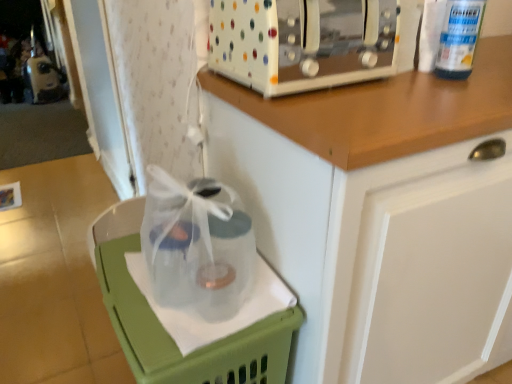
Question: Is white polka dot toaster at upper center oriented away from green plastic basket at lower left?

Choices:
 (A) no
 (B) yes

Answer: (A)

Question: Considering the relative sizes of white polka dot toaster at upper center and green plastic basket at lower left in the image provided, is white polka dot toaster at upper center smaller than green plastic basket at lower left?

Choices:
 (A) no
 (B) yes

Answer: (B)

Question: Is white polka dot toaster at upper center wider than green plastic basket at lower left?

Choices:
 (A) no
 (B) yes

Answer: (A)

Question: From a real-world perspective, is white polka dot toaster at upper center physically below green plastic basket at lower left?

Choices:
 (A) yes
 (B) no

Answer: (B)

Question: Considering the relative sizes of white polka dot toaster at upper center and green plastic basket at lower left in the image provided, is white polka dot toaster at upper center thinner than green plastic basket at lower left?

Choices:
 (A) no
 (B) yes

Answer: (B)

Question: In terms of width, does green plastic basket at lower left look wider or thinner when compared to white glossy cabinet at upper center?

Choices:
 (A) wide
 (B) thin

Answer: (B)

Question: Is point (217, 382) positioned closer to the camera than point (343, 97)?

Choices:
 (A) closer
 (B) farther

Answer: (A)

Question: In the image, is green plastic basket at lower left positioned in front of or behind white glossy cabinet at upper center?

Choices:
 (A) front
 (B) behind

Answer: (B)

Question: Considering the positions of green plastic basket at lower left and white glossy cabinet at upper center in the image, is green plastic basket at lower left bigger or smaller than white glossy cabinet at upper center?

Choices:
 (A) big
 (B) small

Answer: (B)

Question: Does point (138, 236) appear closer or farther from the camera than point (468, 61)?

Choices:
 (A) closer
 (B) farther

Answer: (B)

Question: Is green plastic basket at lower left inside the boundaries of white plastic bottle at upper right, or outside?

Choices:
 (A) inside
 (B) outside

Answer: (B)

Question: Considering the positions of green plastic basket at lower left and white plastic bottle at upper right in the image, is green plastic basket at lower left wider or thinner than white plastic bottle at upper right?

Choices:
 (A) wide
 (B) thin

Answer: (A)

Question: Is green plastic basket at lower left taller or shorter than white plastic bottle at upper right?

Choices:
 (A) tall
 (B) short

Answer: (A)

Question: Is white glossy cabinet at upper center in front of or behind green plastic basket at lower left in the image?

Choices:
 (A) front
 (B) behind

Answer: (A)

Question: Considering the positions of white glossy cabinet at upper center and green plastic basket at lower left in the image, is white glossy cabinet at upper center taller or shorter than green plastic basket at lower left?

Choices:
 (A) tall
 (B) short

Answer: (A)